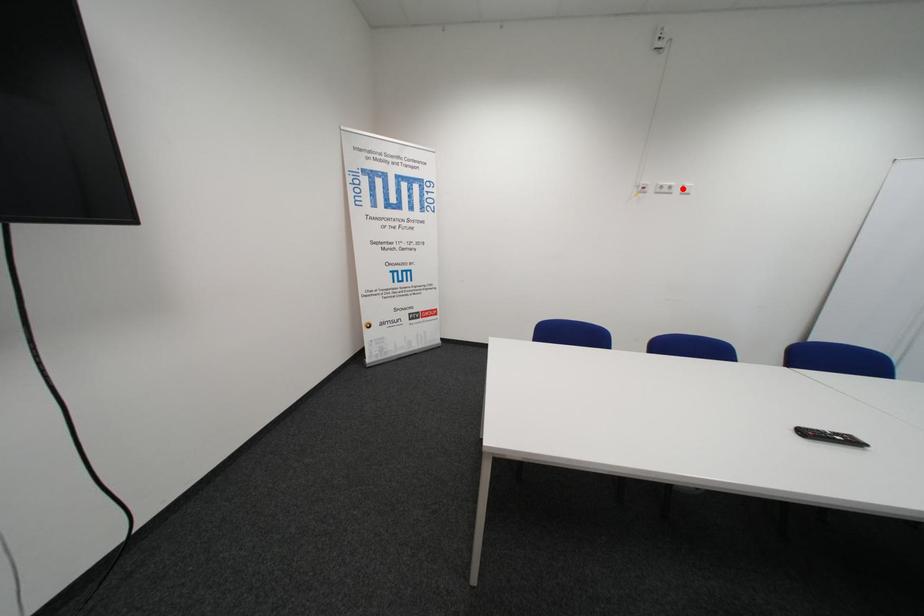
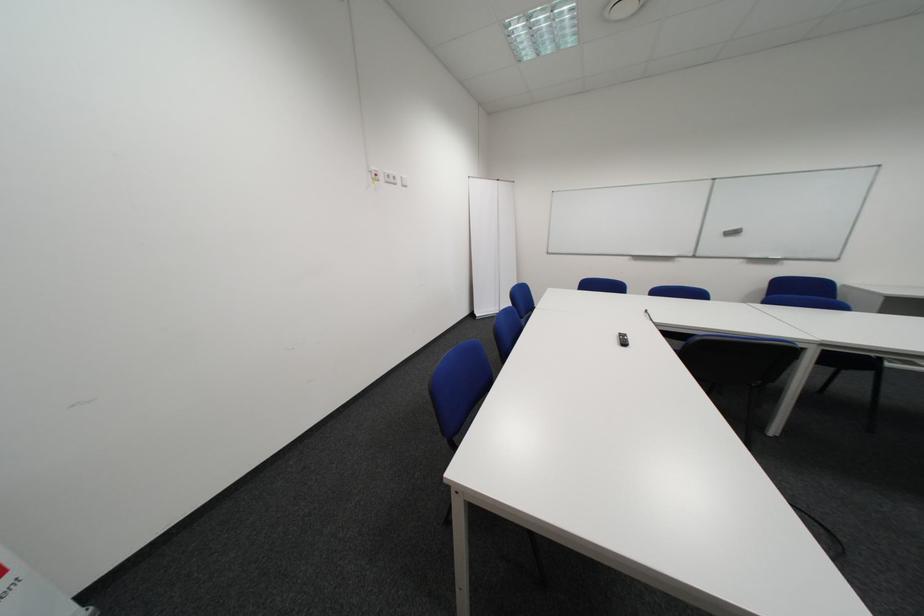
Question: I am providing you with two images of the same scene from different viewpoints. A red point is marked on the first image. Can you still see the location of the red point in image 2?

Choices:
 (A) Yes
 (B) No

Answer: (A)